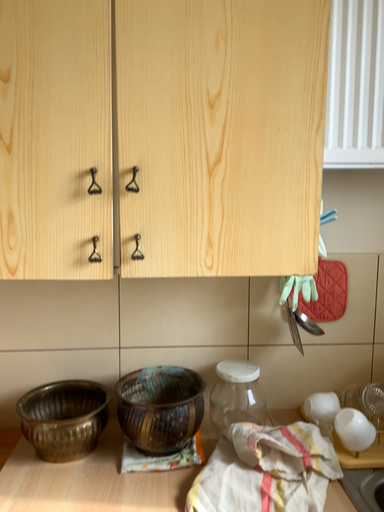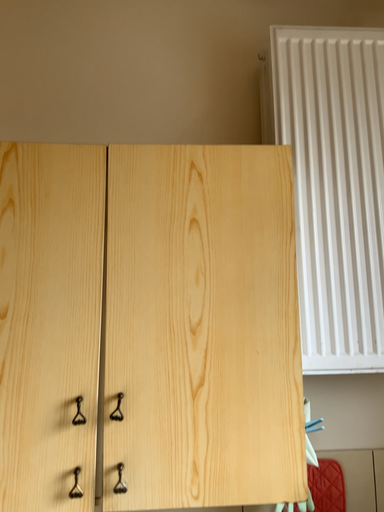
Question: How did the camera likely rotate when shooting the video?

Choices:
 (A) rotated downward
 (B) rotated upward

Answer: (B)